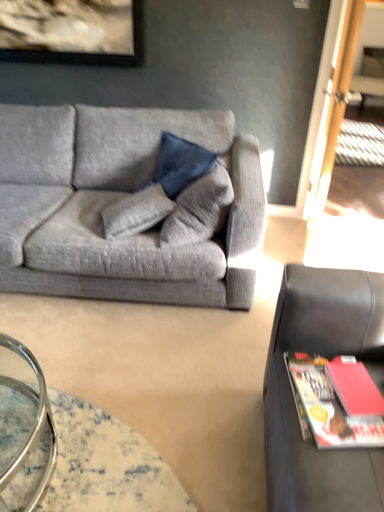
The height and width of the screenshot is (512, 384). Find the location of `blank space to the left of matte red book at lower right`. blank space to the left of matte red book at lower right is located at coordinates (306, 391).